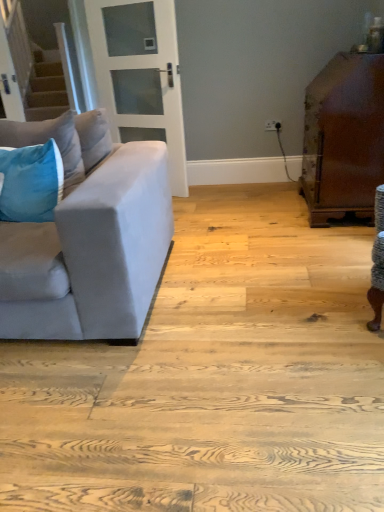
Question: Is velvet blue pillow at left, arranged as the first pillow when ordered from the bottom, wider than velvet blue pillow at left, the first pillow viewed from the top?

Choices:
 (A) no
 (B) yes

Answer: (A)

Question: Would you say velvet blue pillow at left, the first pillow viewed from the top, is part of velvet blue pillow at left, arranged as the first pillow when ordered from the bottom,'s contents?

Choices:
 (A) yes
 (B) no

Answer: (B)

Question: Can you confirm if velvet blue pillow at left, which is the second pillow in top-to-bottom order, is smaller than velvet blue pillow at left, the first pillow viewed from the top?

Choices:
 (A) yes
 (B) no

Answer: (A)

Question: From a real-world perspective, is velvet blue pillow at left, arranged as the first pillow when ordered from the bottom, positioned under velvet blue pillow at left, the first pillow viewed from the top, based on gravity?

Choices:
 (A) no
 (B) yes

Answer: (B)

Question: Considering the relative positions of velvet blue pillow at left, arranged as the first pillow when ordered from the bottom, and velvet blue pillow at left, the 2th pillow in the bottom-to-top sequence, in the image provided, is velvet blue pillow at left, arranged as the first pillow when ordered from the bottom, behind velvet blue pillow at left, the 2th pillow in the bottom-to-top sequence,?

Choices:
 (A) no
 (B) yes

Answer: (A)

Question: Is suede gray couch at left inside the boundaries of glossy brown wooden cabinet at right, or outside?

Choices:
 (A) inside
 (B) outside

Answer: (B)

Question: Is suede gray couch at left to the left or to the right of glossy brown wooden cabinet at right in the image?

Choices:
 (A) right
 (B) left

Answer: (B)

Question: Is suede gray couch at left in front of or behind glossy brown wooden cabinet at right in the image?

Choices:
 (A) front
 (B) behind

Answer: (A)

Question: From a real-world perspective, is suede gray couch at left above or below glossy brown wooden cabinet at right?

Choices:
 (A) below
 (B) above

Answer: (A)

Question: Is velvet blue pillow at left, arranged as the first pillow when ordered from the bottom, spatially inside white glass door at upper center, or outside of it?

Choices:
 (A) outside
 (B) inside

Answer: (A)

Question: From a real-world perspective, relative to white glass door at upper center, is velvet blue pillow at left, which is the second pillow in top-to-bottom order, vertically above or below?

Choices:
 (A) above
 (B) below

Answer: (B)

Question: Looking at their shapes, would you say velvet blue pillow at left, arranged as the first pillow when ordered from the bottom, is wider or thinner than white glass door at upper center?

Choices:
 (A) thin
 (B) wide

Answer: (B)

Question: Relative to white glass door at upper center, is velvet blue pillow at left, which is the second pillow in top-to-bottom order, in front or behind?

Choices:
 (A) front
 (B) behind

Answer: (A)

Question: From the image's perspective, is glossy brown wooden cabinet at right positioned above or below velvet blue pillow at left, arranged as the first pillow when ordered from the bottom?

Choices:
 (A) below
 (B) above

Answer: (B)

Question: Looking at the image, does glossy brown wooden cabinet at right seem bigger or smaller compared to velvet blue pillow at left, which is the second pillow in top-to-bottom order?

Choices:
 (A) big
 (B) small

Answer: (A)